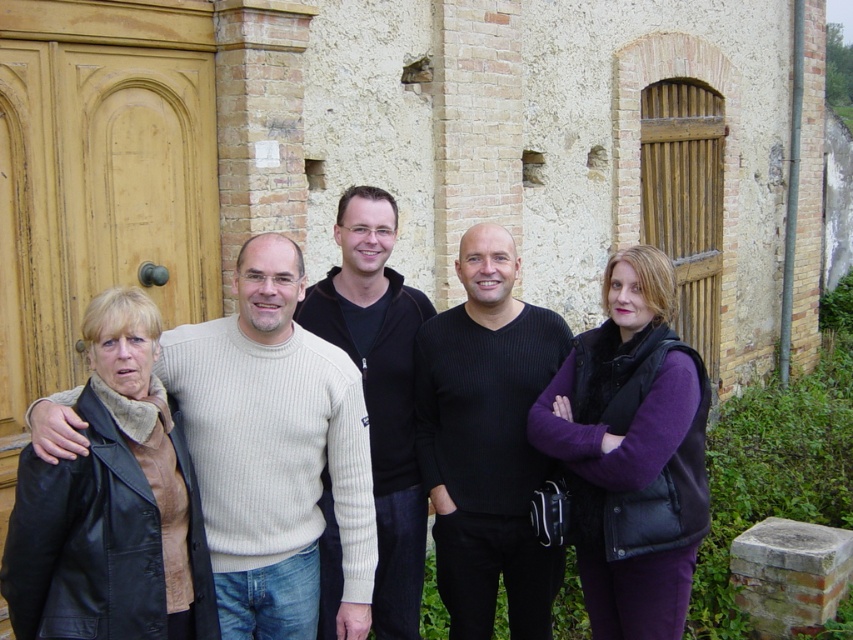
Between light beige sweater at center and purple matte vest at center, which one is positioned higher?

A: light beige sweater at center

Between light beige sweater at center and purple matte vest at center, which one is positioned lower?

purple matte vest at center is below.

The image size is (853, 640). Describe the element at coordinates (274, 451) in the screenshot. I see `light beige sweater at center` at that location.

The height and width of the screenshot is (640, 853). Identify the location of light beige sweater at center. (274, 451).

Can you confirm if purple matte vest at center is positioned to the left of black ribbed sweater at center?

Incorrect, purple matte vest at center is not on the left side of black ribbed sweater at center.

From the picture: How far apart are purple matte vest at center and black ribbed sweater at center?

purple matte vest at center is 16.20 inches from black ribbed sweater at center.

Which is behind, point (656, 381) or point (457, 417)?

The point (457, 417) is more distant.

Find the location of a particular element. purple matte vest at center is located at coordinates (631, 451).

Who is more distant from viewer, (338, 442) or (463, 536)?

Point (463, 536)

Can you confirm if light beige sweater at center is wider than black ribbed sweater at center?

Correct, the width of light beige sweater at center exceeds that of black ribbed sweater at center.

Is point (212, 458) positioned after point (480, 396)?

No, it is not.

At what (x,y) coordinates should I click in order to perform the action: click on light beige sweater at center. Please return your answer as a coordinate pair (x, y). Looking at the image, I should click on (274, 451).